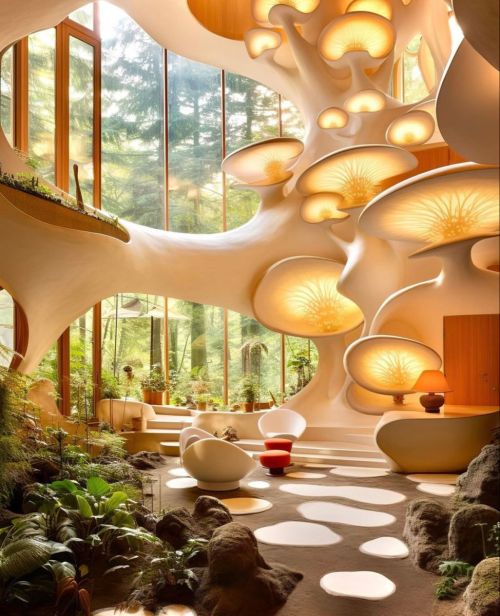
You are a GUI agent. You are given a task and a screenshot of the screen. Output one action in this format:
    pyautogui.click(x=<x>, y=<y>)
    Task: Click on the tables
    
    Given the screenshot: What is the action you would take?
    pyautogui.click(x=285, y=440), pyautogui.click(x=275, y=459)